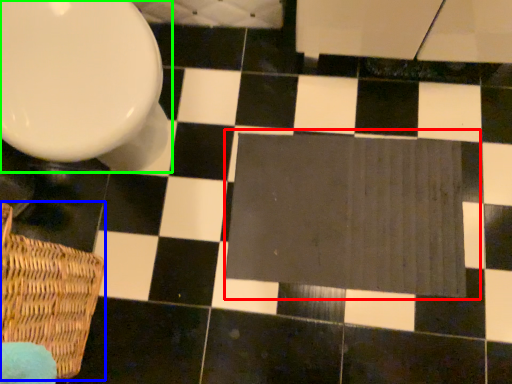
Question: Which is farther away from bath mat (highlighted by a red box)? basket (highlighted by a blue box) or toilet (highlighted by a green box)?

Choices:
 (A) basket
 (B) toilet

Answer: (A)